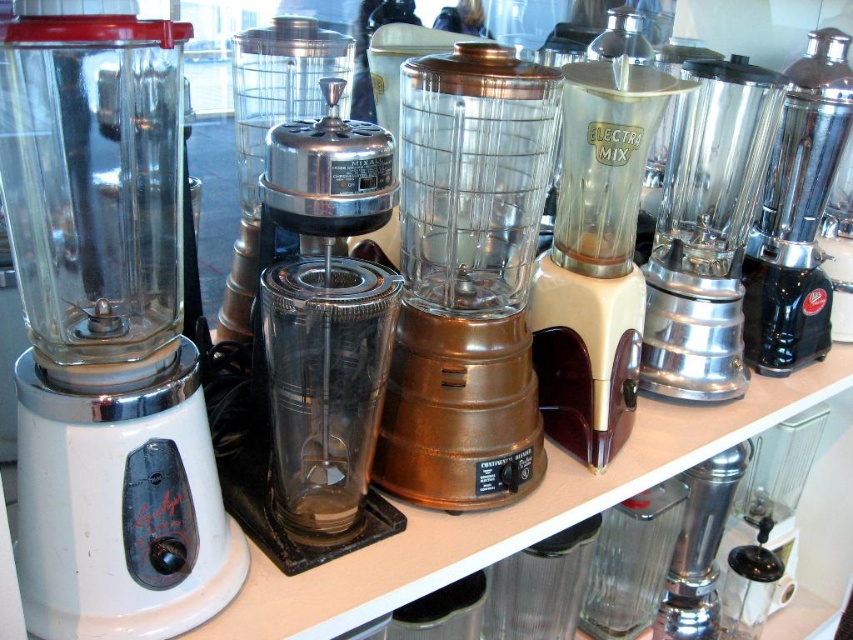
Between white plastic blender at left and copper metallic blender at center, which one appears on the right side from the viewer's perspective?

From the viewer's perspective, copper metallic blender at center appears more on the right side.

Does point (80, 141) lie behind point (511, 348)?

That is False.

Identify the location of white plastic blender at left. (106, 332).

Can you confirm if shiny metallic blender at right is positioned below polished stainless steel mixer at right?

Indeed, shiny metallic blender at right is positioned under polished stainless steel mixer at right.

Is shiny metallic blender at right positioned before polished stainless steel mixer at right?

That is True.

Measure the distance between point (675, 348) and camera.

Point (675, 348) and camera are 3.33 feet apart from each other.

This screenshot has width=853, height=640. In order to click on shiny metallic blender at right in this screenshot , I will do `click(706, 230)`.

Does shiny chrome mixer at center lie in front of polished stainless steel mixer at right?

Yes, it is in front of polished stainless steel mixer at right.

Is shiny chrome mixer at center wider than polished stainless steel mixer at right?

No.

The height and width of the screenshot is (640, 853). I want to click on shiny chrome mixer at center, so click(x=317, y=346).